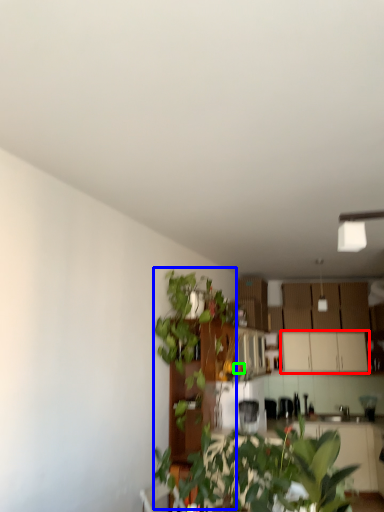
Question: Based on their relative distances, which object is nearer to cabinetry (highlighted by a red box)? Choose from vegetation (highlighted by a blue box) and flower (highlighted by a green box).

Choices:
 (A) vegetation
 (B) flower

Answer: (B)